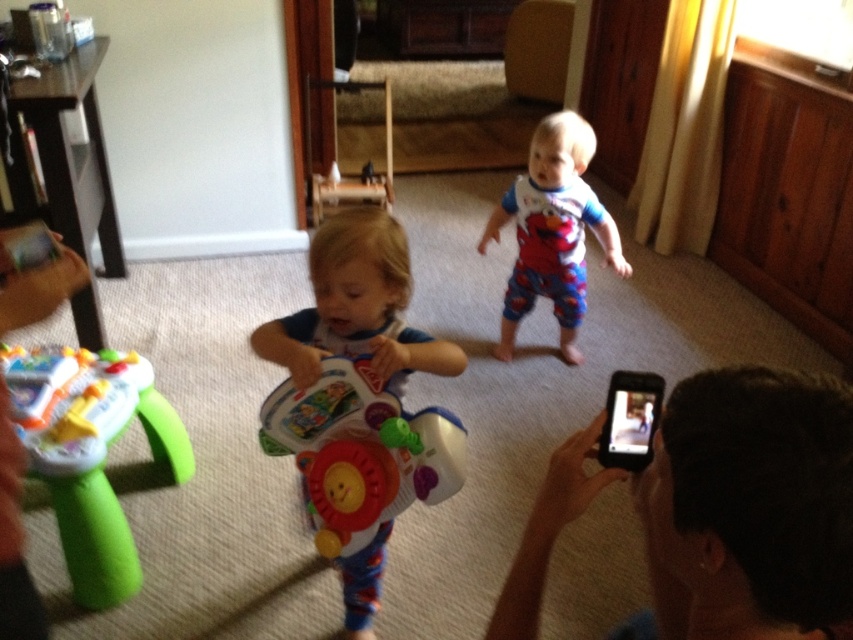
Question: Is black plastic phone at lower right closer to the viewer compared to plastic colorful walker at center?

Choices:
 (A) no
 (B) yes

Answer: (B)

Question: Estimate the real-world distances between objects in this image. Which object is farther from the green plastic toy at lower left?

Choices:
 (A) black plastic phone at lower right
 (B) plastic toy at center

Answer: (A)

Question: Among these objects, which one is farthest from the camera?

Choices:
 (A) white cotton pajamas at center
 (B) plastic toy at center
 (C) black plastic phone at lower right

Answer: (A)

Question: Can you confirm if black plastic phone at lower right is thinner than plastic colorful walker at center?

Choices:
 (A) yes
 (B) no

Answer: (A)

Question: Among these points, which one is nearest to the camera?

Choices:
 (A) (32, 365)
 (B) (544, 164)

Answer: (A)

Question: Can you confirm if green plastic toy at lower left is smaller than plastic toy at center?

Choices:
 (A) no
 (B) yes

Answer: (A)